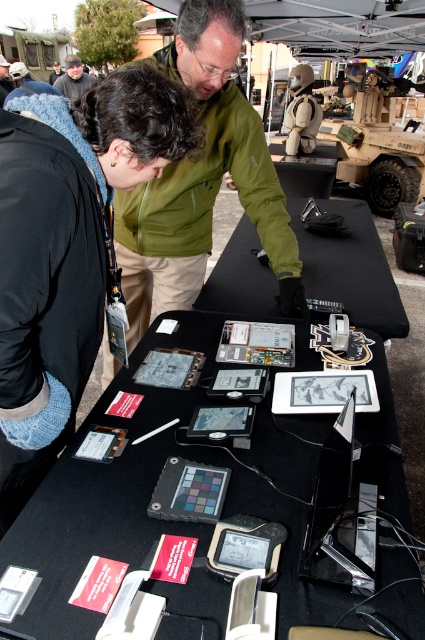
In the scene shown: You are a photographer setting up for an event. You notice the black fleece jacket at upper left and the jeans at lower left. Which item should you focus on if you want to capture the smaller object in your frame?

The black fleece jacket at upper left is smaller than the jeans at lower left, so you should focus on the black fleece jacket at upper left to capture the smaller object.